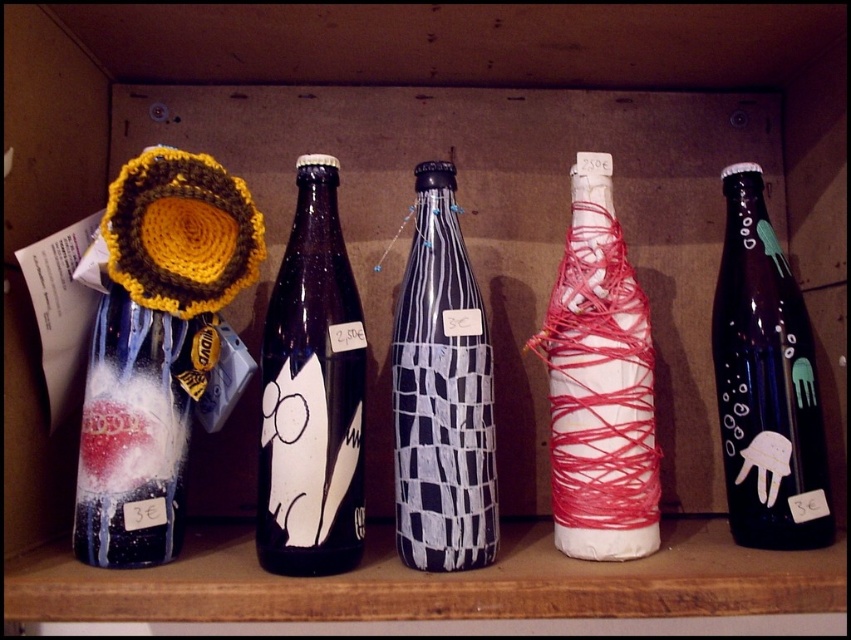
You are a customer at a craft store looking at the bottles. You want to pick up the matte black bottle at center. Can you easily reach it without moving the white yarn wrapped bottle at center?

The matte black bottle at center is in front of the white yarn wrapped bottle at center, so you can easily reach it without moving the white yarn wrapped bottle at center.